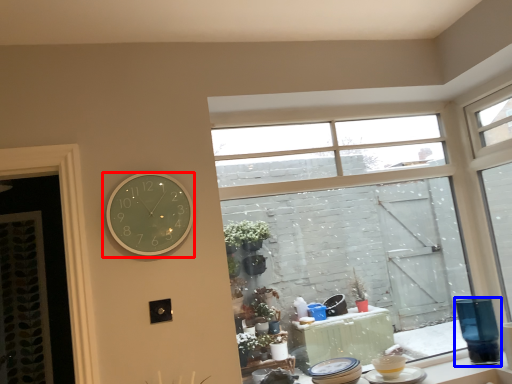
Question: Among these objects, which one is farthest to the camera, wall clock (highlighted by a red box) or glass vase (highlighted by a blue box)?

Choices:
 (A) wall clock
 (B) glass vase

Answer: (B)